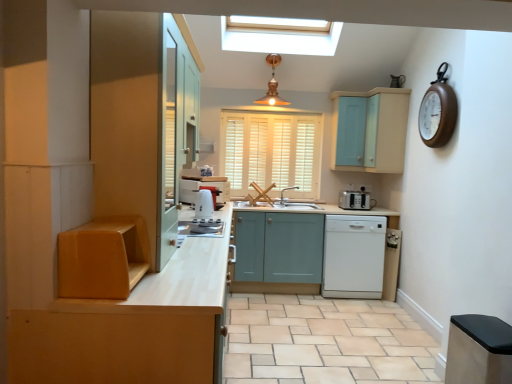
Question: Is copper/textured pendant light at upper center beside stainless steel trash can at lower right, the fourth cabinetry from the left?

Choices:
 (A) yes
 (B) no

Answer: (B)

Question: Can you confirm if copper/textured pendant light at upper center is shorter than stainless steel trash can at lower right, which ranks as the second cabinetry in right-to-left order?

Choices:
 (A) yes
 (B) no

Answer: (B)

Question: From a real-world perspective, does copper/textured pendant light at upper center stand above stainless steel trash can at lower right, which ranks as the second cabinetry in right-to-left order?

Choices:
 (A) yes
 (B) no

Answer: (A)

Question: Is copper/textured pendant light at upper center taller than stainless steel trash can at lower right, which ranks as the second cabinetry in right-to-left order?

Choices:
 (A) no
 (B) yes

Answer: (B)

Question: Is copper/textured pendant light at upper center not close to stainless steel trash can at lower right, which ranks as the second cabinetry in right-to-left order?

Choices:
 (A) yes
 (B) no

Answer: (A)

Question: From the image's perspective, is copper/textured pendant light at upper center located above or below wooden clock at upper right?

Choices:
 (A) below
 (B) above

Answer: (B)

Question: Considering the positions of point (275, 86) and point (446, 89), is point (275, 86) closer or farther from the camera than point (446, 89)?

Choices:
 (A) closer
 (B) farther

Answer: (B)

Question: Considering the positions of copper/textured pendant light at upper center and wooden clock at upper right in the image, is copper/textured pendant light at upper center wider or thinner than wooden clock at upper right?

Choices:
 (A) wide
 (B) thin

Answer: (A)

Question: Is copper/textured pendant light at upper center spatially inside wooden clock at upper right, or outside of it?

Choices:
 (A) inside
 (B) outside

Answer: (B)

Question: In terms of width, does white plastic toaster at right look wider or thinner when compared to white wood blinds at center?

Choices:
 (A) wide
 (B) thin

Answer: (A)

Question: Considering their positions, is white plastic toaster at right located in front of or behind white wood blinds at center?

Choices:
 (A) front
 (B) behind

Answer: (A)

Question: Considering the positions of point (362, 192) and point (314, 114), is point (362, 192) closer or farther from the camera than point (314, 114)?

Choices:
 (A) closer
 (B) farther

Answer: (A)

Question: Do you think white plastic toaster at right is within white wood blinds at center, or outside of it?

Choices:
 (A) outside
 (B) inside

Answer: (A)

Question: Do you think white wood blinds at center is within white plastic toaster at right, or outside of it?

Choices:
 (A) outside
 (B) inside

Answer: (A)

Question: From their relative heights in the image, would you say white wood blinds at center is taller or shorter than white plastic toaster at right?

Choices:
 (A) tall
 (B) short

Answer: (A)